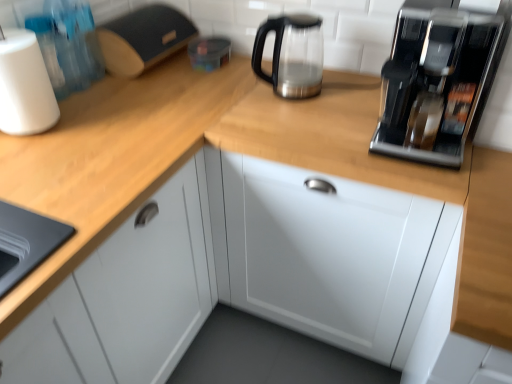
The width and height of the screenshot is (512, 384). Find the location of `vacant space to the right of matte black bread bin at upper left`. vacant space to the right of matte black bread bin at upper left is located at coordinates (216, 67).